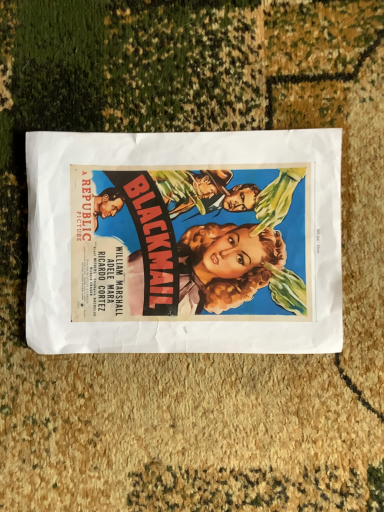
Based on the photo, in order to face matte paper poster at center, should I rotate leftwards or rightwards?

It's best to rotate left around 1.186 degrees.

At what (x,y) coordinates should I click in order to perform the action: click on matte paper poster at center. Please return your answer as a coordinate pair (x, y). The width and height of the screenshot is (384, 512). Looking at the image, I should click on (184, 242).

Image resolution: width=384 pixels, height=512 pixels. Describe the element at coordinates (184, 242) in the screenshot. I see `matte paper poster at center` at that location.

What is the approximate width of matte paper poster at center?

matte paper poster at center is 11.87 inches in width.

This screenshot has height=512, width=384. I want to click on matte paper poster at center, so click(184, 242).